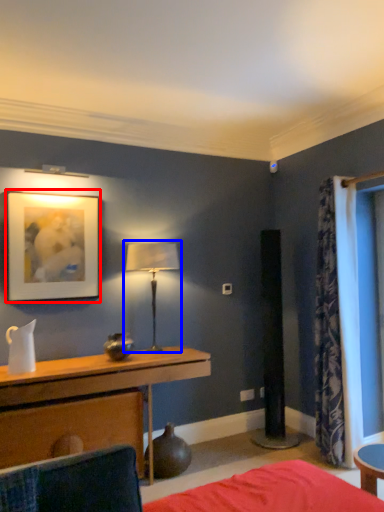
Question: Which object appears closest to the camera in this image, picture frame (highlighted by a red box) or table lamp (highlighted by a blue box)?

Choices:
 (A) picture frame
 (B) table lamp

Answer: (A)